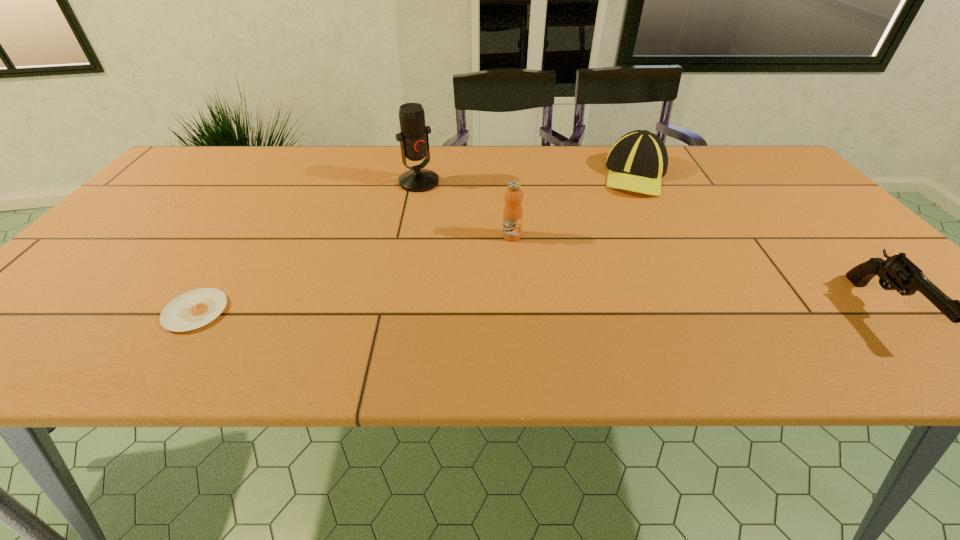
Find the location of a particular element. The height and width of the screenshot is (540, 960). egg yolk is located at coordinates (194, 309).

The width and height of the screenshot is (960, 540). In order to click on the leftmost object in this screenshot , I will do `click(194, 309)`.

At what (x,y) coordinates should I click in order to perform the action: click on the rightmost object. Please return your answer as a coordinate pair (x, y). Looking at the image, I should click on (898, 271).

Find the location of `orange juice`. orange juice is located at coordinates (512, 214).

You are a GUI agent. You are given a task and a screenshot of the screen. Output one action in this format:
    pyautogui.click(x=<x>, y=<y>)
    Task: Click on the fourth shortest object
    The image size is (960, 540).
    Given the screenshot: What is the action you would take?
    pyautogui.click(x=512, y=214)

At what (x,y) coordinates should I click in order to perform the action: click on microphone. Please return your answer as a coordinate pair (x, y). Looking at the image, I should click on (414, 142).

Image resolution: width=960 pixels, height=540 pixels. Find the location of `the second object from left to right`. the second object from left to right is located at coordinates tap(414, 142).

The width and height of the screenshot is (960, 540). Identify the location of the second object from right to left. (637, 161).

The width and height of the screenshot is (960, 540). What are the coordinates of `free space located 0.250m on the back of the egg yolk` in the screenshot? It's located at (x=254, y=222).

Locate an element on the screen. The image size is (960, 540). vacant space located 0.130m on the front label of the second tallest object is located at coordinates (517, 279).